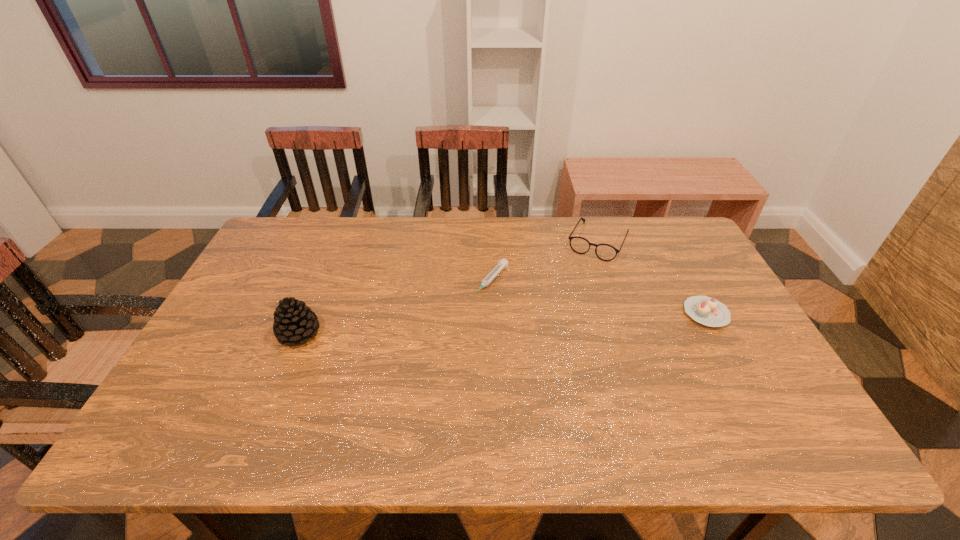
I want to click on free area in between the tallest object and the third shortest object, so click(x=448, y=288).

This screenshot has width=960, height=540. Find the location of `empty location between the third object from left to right and the pinecone`. empty location between the third object from left to right and the pinecone is located at coordinates (448, 288).

Where is `free spot between the third object from left to right and the rightmost object`? free spot between the third object from left to right and the rightmost object is located at coordinates (652, 278).

Where is `free space between the syringe and the leftmost object`? Image resolution: width=960 pixels, height=540 pixels. free space between the syringe and the leftmost object is located at coordinates (396, 307).

The image size is (960, 540). I want to click on object identified as the second closest to the second object from left to right, so click(294, 322).

Where is `the third closest object relative to the third shortest object`? This screenshot has width=960, height=540. the third closest object relative to the third shortest object is located at coordinates (294, 322).

Image resolution: width=960 pixels, height=540 pixels. What are the coordinates of `free space that satisfies the following two spatial constraints: 1. on the back side of the third shortest object; 2. on the right side of the syringe` in the screenshot? It's located at (490, 242).